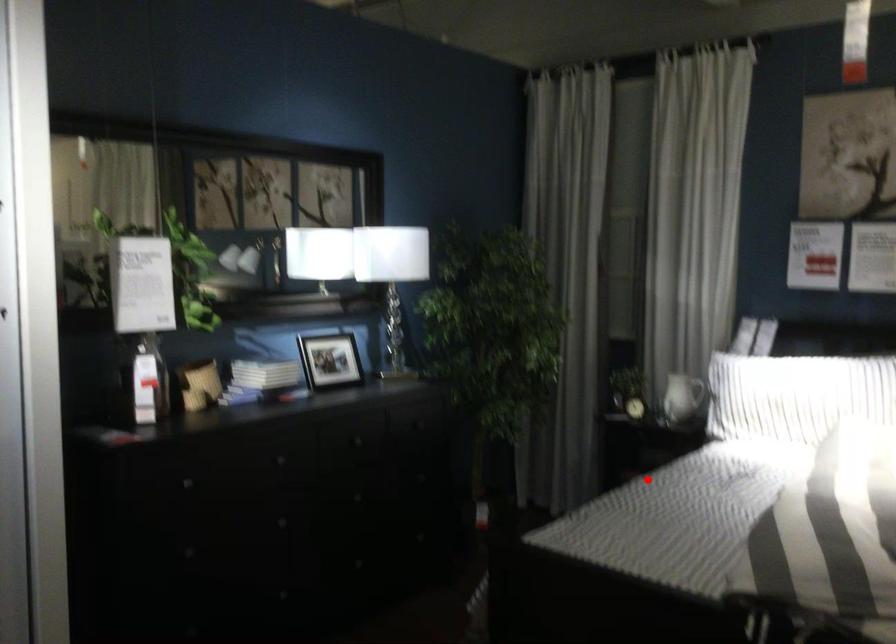
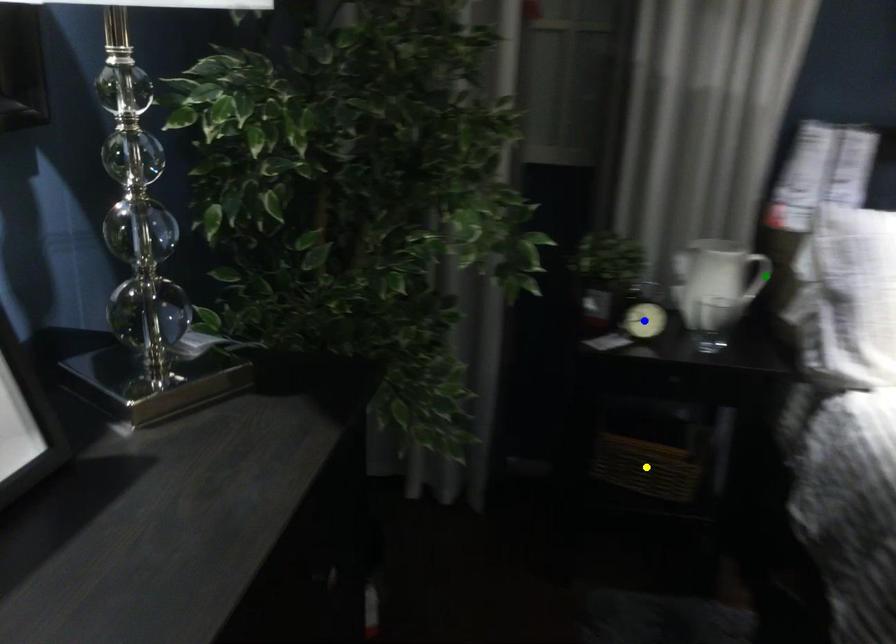
Question: I am providing you with two images of the same scene from different viewpoints. A red point is marked on the first image. You are given multiple points on the second image. Which point in image 2 is actually the same real-world point as the red point in image 1?

Choices:
 (A) green point
 (B) yellow point
 (C) blue point

Answer: (B)